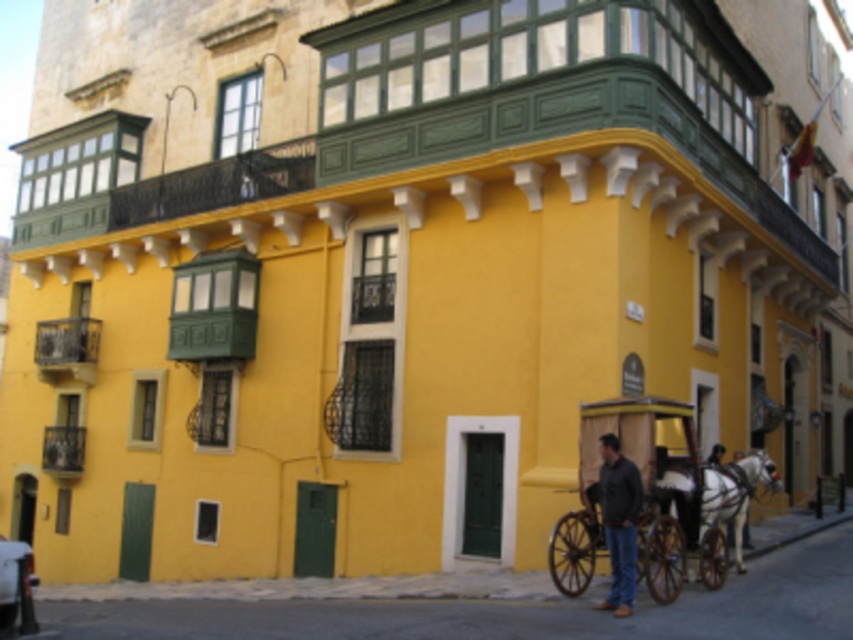
You are standing at the entrance of the yellow building and want to find the wooden cart at lower right. Based on the coordinates provided, in which direction should you walk to reach it?

The wooden cart at lower right is located at coordinates point (x=642, y=500), which means it is positioned to the right and slightly downward from your current position at the entrance. You should walk towards the lower right direction to reach it.

You are standing in front of the yellow building and want to move from the wooden cart at lower right to the metallic silver car at lower left. Which direction should you move to reach the car?

To move from the wooden cart at lower right to the metallic silver car at lower left, you should move downward since the wooden cart at lower right is located above the metallic silver car at lower left.

You are a pedestrian standing at the center of the image, facing the yellow building. You need to cross the street to reach the building. Are there any obstacles blocking your path between the wooden cart at lower right and the metallic silver car at lower left?

The metallic silver car at lower left is behind the wooden cart at lower right, so the wooden cart is in front. This means the wooden cart at lower right is blocking the path between the two objects, making it an obstacle to cross the street.